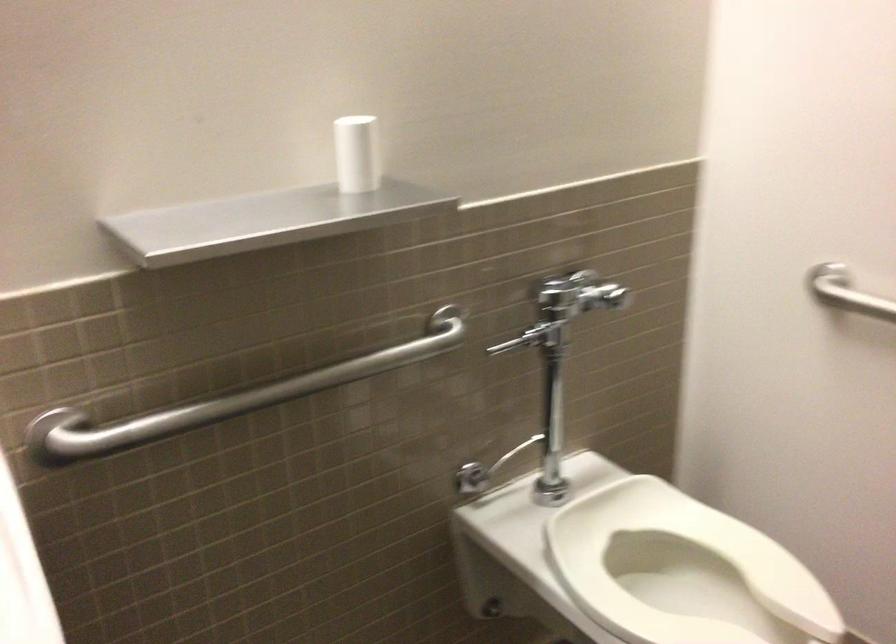
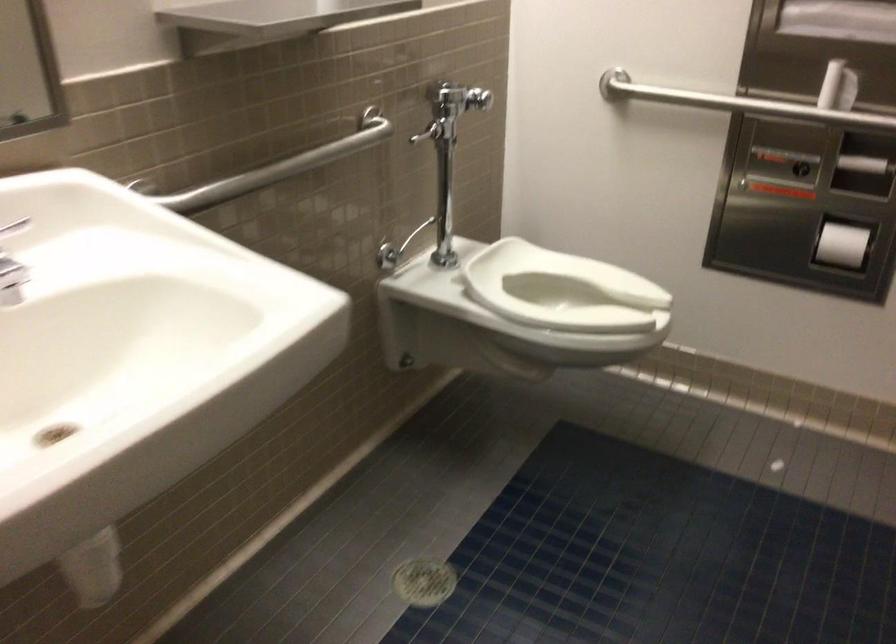
In the second image, find the point that corresponds to (x=261, y=395) in the first image.

(277, 167)